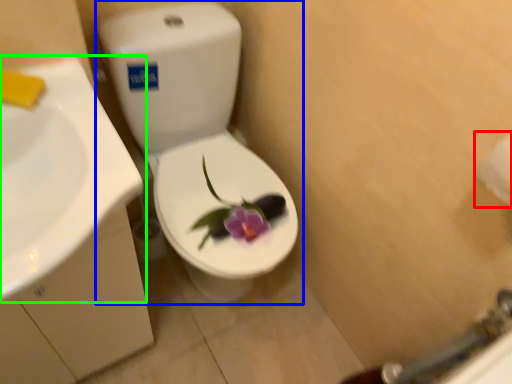
Question: Which is farther away from toilet paper (highlighted by a red box)? toilet (highlighted by a blue box) or sink (highlighted by a green box)?

Choices:
 (A) toilet
 (B) sink

Answer: (A)